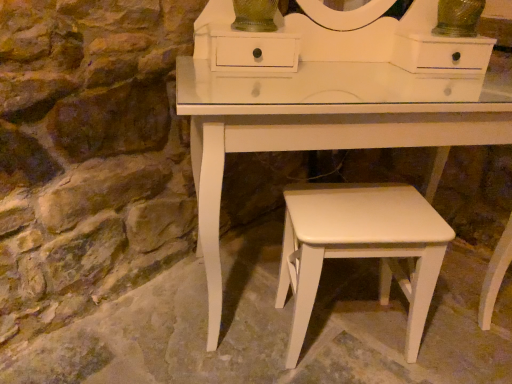
Locate an element on the screen. Image resolution: width=512 pixels, height=384 pixels. vacant area that is situated to the right of white matte stool at center is located at coordinates (454, 342).